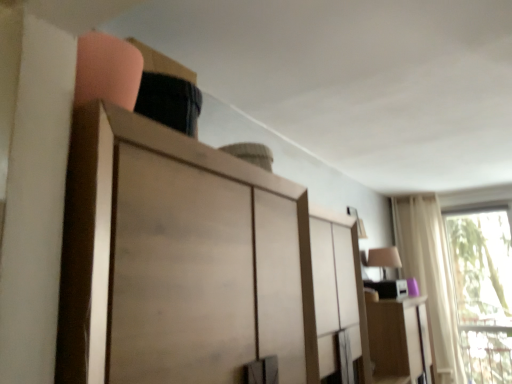
Question: Should I look upward or downward to see white sheer curtain at right?

Choices:
 (A) up
 (B) down

Answer: (B)

Question: Is the depth of transparent glass window at right greater than that of white sheer curtain at right?

Choices:
 (A) yes
 (B) no

Answer: (B)

Question: Is transparent glass window at right shorter than white sheer curtain at right?

Choices:
 (A) no
 (B) yes

Answer: (B)

Question: Is transparent glass window at right smaller than white sheer curtain at right?

Choices:
 (A) no
 (B) yes

Answer: (B)

Question: Can you see transparent glass window at right touching white sheer curtain at right?

Choices:
 (A) yes
 (B) no

Answer: (B)

Question: Considering the relative positions of transparent glass window at right and white sheer curtain at right in the image provided, is transparent glass window at right to the right of white sheer curtain at right from the viewer's perspective?

Choices:
 (A) yes
 (B) no

Answer: (A)

Question: Is transparent glass window at right outside white sheer curtain at right?

Choices:
 (A) yes
 (B) no

Answer: (A)

Question: From the image's perspective, is wooden cabinet at upper center under matte wood cabinet at right?

Choices:
 (A) yes
 (B) no

Answer: (B)

Question: Is wooden cabinet at upper center not close to matte wood cabinet at right?

Choices:
 (A) no
 (B) yes

Answer: (B)

Question: Is wooden cabinet at upper center looking in the opposite direction of matte wood cabinet at right?

Choices:
 (A) no
 (B) yes

Answer: (A)

Question: Considering the relative sizes of wooden cabinet at upper center and matte wood cabinet at right in the image provided, is wooden cabinet at upper center bigger than matte wood cabinet at right?

Choices:
 (A) no
 (B) yes

Answer: (B)

Question: Does wooden cabinet at upper center have a lesser width compared to matte wood cabinet at right?

Choices:
 (A) no
 (B) yes

Answer: (A)

Question: From a real-world perspective, is wooden cabinet at upper center physically below matte wood cabinet at right?

Choices:
 (A) no
 (B) yes

Answer: (A)

Question: Considering the relative sizes of transparent glass window at right and matte wood cabinet at right in the image provided, is transparent glass window at right bigger than matte wood cabinet at right?

Choices:
 (A) yes
 (B) no

Answer: (B)